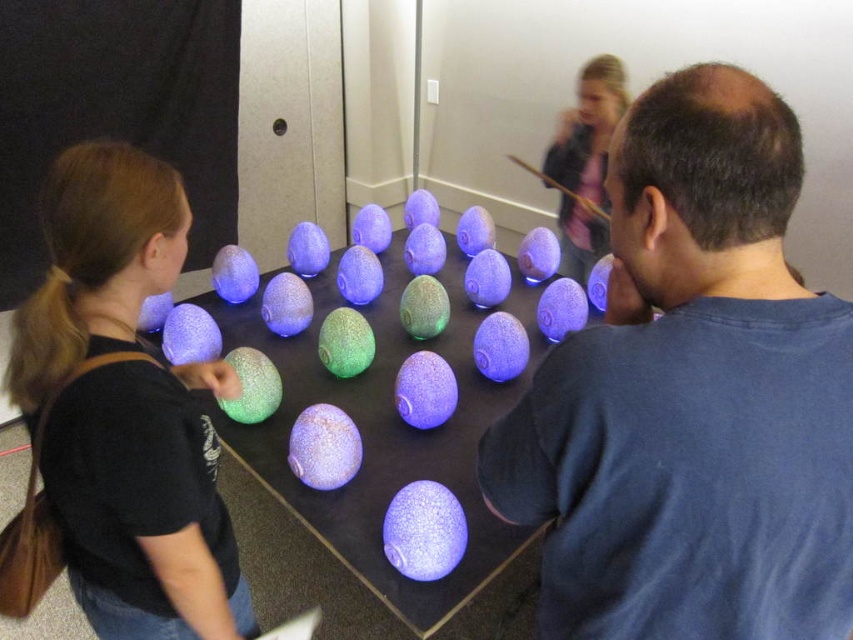
You are standing in front of the display and want to take a photo of the matte blue egg at center and the speckled glass eggs at center. Which one should you focus on first to ensure both are in sharp focus?

You should focus on the matte blue egg at center first because it is closer to the viewer than the speckled glass eggs at center, so adjusting focus from near to far will help both be in sharp focus.

You are designing a display case for the matte blue egg at center and the matte black jacket at upper center. The case has a width limit of 30 cm. Given their sizes, can both items fit side by side without overlapping?

The matte blue egg at center is wider than the matte black jacket at upper center. However, without knowing their exact widths, it is impossible to determine if their combined width exceeds 30 cm. Additional measurements are needed.

You are standing in front of the display of glowing spheres. There is a point marked at coordinates (x=692, y=396). What object is located at that point?

The point at coordinates (x=692, y=396) indicates the matte blue egg at center.